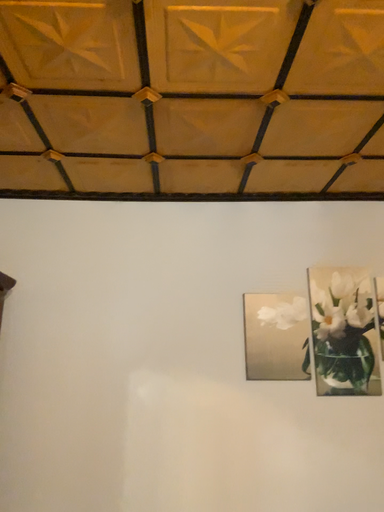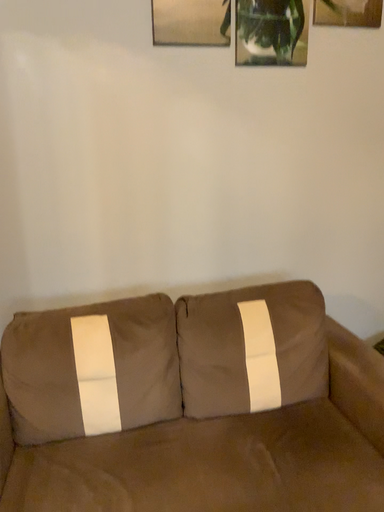
Question: Which way did the camera rotate in the video?

Choices:
 (A) rotated right
 (B) rotated left

Answer: (A)